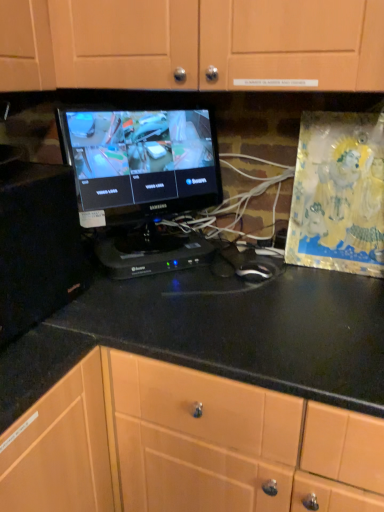
Question: Considering the relative sizes of black matte cabinet at left, the second cabinetry in the top-to-bottom sequence, and black glossy countertop at center in the image provided, is black matte cabinet at left, the second cabinetry in the top-to-bottom sequence, thinner than black glossy countertop at center?

Choices:
 (A) yes
 (B) no

Answer: (A)

Question: Does black matte cabinet at left, the second cabinetry in the top-to-bottom sequence, come in front of black glossy countertop at center?

Choices:
 (A) yes
 (B) no

Answer: (B)

Question: Does black matte cabinet at left, which ranks as the 1th cabinetry in left-to-right order, have a greater width compared to black glossy countertop at center?

Choices:
 (A) no
 (B) yes

Answer: (A)

Question: From a real-world perspective, is black matte cabinet at left, the second cabinetry in the top-to-bottom sequence, located beneath black glossy countertop at center?

Choices:
 (A) no
 (B) yes

Answer: (A)

Question: Are black matte cabinet at left, which ranks as the 1th cabinetry in left-to-right order, and black glossy countertop at center far apart?

Choices:
 (A) no
 (B) yes

Answer: (A)

Question: Is black matte cabinet at left, which is counted as the second cabinetry, starting from the right, spatially inside matte wood cabinet at upper center, marked as the first cabinetry in a top-to-bottom arrangement, or outside of it?

Choices:
 (A) inside
 (B) outside

Answer: (B)

Question: From the image's perspective, relative to matte wood cabinet at upper center, the 1th cabinetry from the right, is black matte cabinet at left, the second cabinetry in the top-to-bottom sequence, above or below?

Choices:
 (A) above
 (B) below

Answer: (B)

Question: Is black matte cabinet at left, which ranks as the 1th cabinetry in left-to-right order, wider or thinner than matte wood cabinet at upper center, marked as the first cabinetry in a top-to-bottom arrangement?

Choices:
 (A) thin
 (B) wide

Answer: (A)

Question: From a real-world perspective, is black matte cabinet at left, which ranks as the first cabinetry in bottom-to-top order, physically located above or below matte wood cabinet at upper center, which is the 2th cabinetry in bottom-to-top order?

Choices:
 (A) below
 (B) above

Answer: (A)

Question: In terms of size, does matte wood cabinet at upper center, which is the 2th cabinetry from left to right, appear bigger or smaller than black matte cabinet at left, which ranks as the first cabinetry in bottom-to-top order?

Choices:
 (A) big
 (B) small

Answer: (A)

Question: In the image, is matte wood cabinet at upper center, which is the 2th cabinetry from left to right, on the left side or the right side of black matte cabinet at left, which ranks as the first cabinetry in bottom-to-top order?

Choices:
 (A) right
 (B) left

Answer: (A)

Question: Is point (79, 18) closer or farther from the camera than point (69, 295)?

Choices:
 (A) farther
 (B) closer

Answer: (A)

Question: Is matte wood cabinet at upper center, marked as the first cabinetry in a top-to-bottom arrangement, wider or thinner than black matte cabinet at left, which ranks as the 1th cabinetry in left-to-right order?

Choices:
 (A) wide
 (B) thin

Answer: (A)

Question: Considering the positions of black glossy countertop at center and black matte cabinet at left, which ranks as the 1th cabinetry in left-to-right order, in the image, is black glossy countertop at center bigger or smaller than black matte cabinet at left, which ranks as the 1th cabinetry in left-to-right order,?

Choices:
 (A) small
 (B) big

Answer: (B)

Question: From the image's perspective, is black glossy countertop at center positioned above or below black matte cabinet at left, the second cabinetry in the top-to-bottom sequence?

Choices:
 (A) below
 (B) above

Answer: (A)